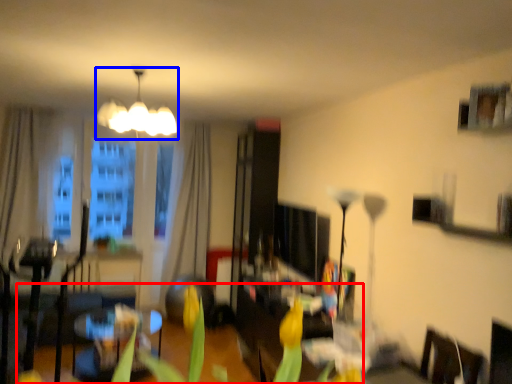
Question: Which object is further to the camera taking this photo, plant (highlighted by a red box) or lamp (highlighted by a blue box)?

Choices:
 (A) plant
 (B) lamp

Answer: (B)